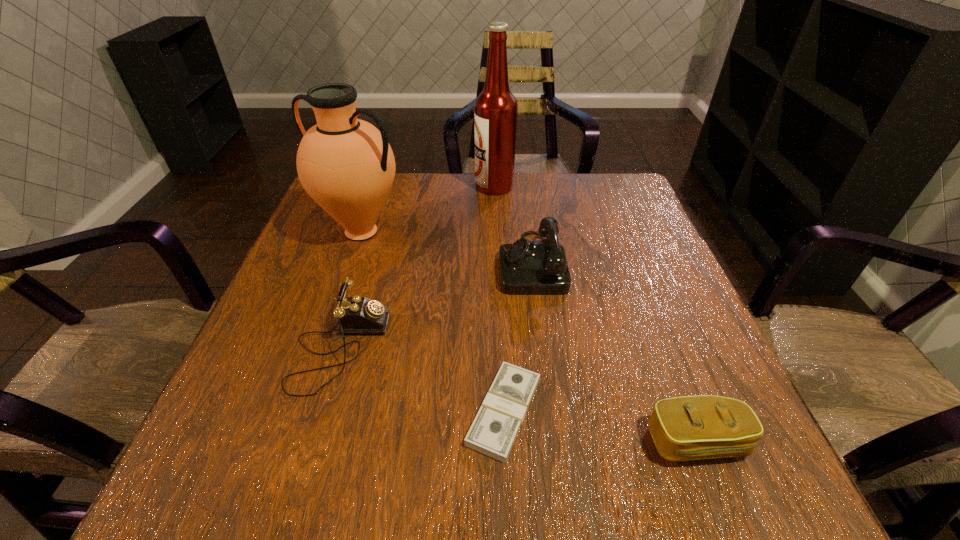
Locate an element on the screen. The image size is (960, 540). free space at the right edge of the desktop is located at coordinates (614, 308).

This screenshot has height=540, width=960. In the image, there is a desktop. What are the coordinates of `vacant space at the far right corner` in the screenshot? It's located at (619, 203).

Where is `vacant area at the near right corner`? Image resolution: width=960 pixels, height=540 pixels. vacant area at the near right corner is located at coordinates (741, 488).

Locate an element on the screen. free spot between the second tallest object and the shortest object is located at coordinates (433, 321).

Find the location of a particular element. free space between the rightmost object and the pitcher is located at coordinates (529, 336).

I want to click on free space between the pitcher and the clutch bag, so click(529, 336).

This screenshot has height=540, width=960. I want to click on vacant space that's between the farther telephone and the dollar, so point(517,337).

Locate an element on the screen. The width and height of the screenshot is (960, 540). free spot between the fifth shortest object and the right telephone is located at coordinates (446, 247).

Find the location of a particular element. The height and width of the screenshot is (540, 960). free space between the right telephone and the second tallest object is located at coordinates (446, 247).

At what (x,y) coordinates should I click in order to perform the action: click on free space between the third shortest object and the farther telephone. Please return your answer as a coordinate pair (x, y). This screenshot has height=540, width=960. Looking at the image, I should click on [x=436, y=306].